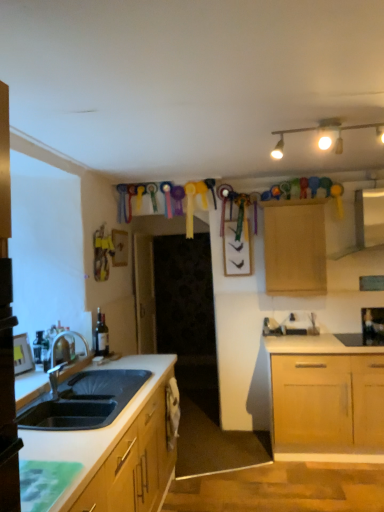
Question: Considering the positions of point (322, 126) and point (276, 203), is point (322, 126) closer or farther from the camera than point (276, 203)?

Choices:
 (A) closer
 (B) farther

Answer: (A)

Question: From a real-world perspective, relative to wooden cabinet at upper center, is matte gold track lights at upper center vertically above or below?

Choices:
 (A) below
 (B) above

Answer: (B)

Question: Which object is the farthest from the wooden cabinet at upper center?

Choices:
 (A) matte gold track lights at upper center
 (B) black glass wine bottle at upper right
 (C) matte white exhaust hood at upper right
 (D) matte glass bottle at sink left

Answer: (D)

Question: Which object is positioned closest to the matte gold track lights at upper center?

Choices:
 (A) matte white exhaust hood at upper right
 (B) matte glass bottle at sink left
 (C) black glass wine bottle at upper right
 (D) wooden cabinet at upper center

Answer: (D)